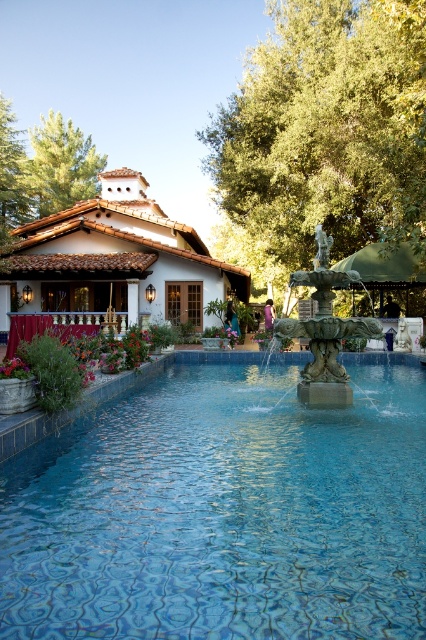
Question: Is blue tile swimming pool at center thinner than green stone fountain at center?

Choices:
 (A) yes
 (B) no

Answer: (B)

Question: Does blue tile swimming pool at center appear over green stone fountain at center?

Choices:
 (A) no
 (B) yes

Answer: (A)

Question: Which of the following is the farthest from the observer?

Choices:
 (A) blue tile swimming pool at center
 (B) green stone fountain at center

Answer: (B)

Question: Does blue tile swimming pool at center have a greater width compared to green stone fountain at center?

Choices:
 (A) yes
 (B) no

Answer: (A)

Question: Which of the following is the closest to the observer?

Choices:
 (A) (60, 604)
 (B) (305, 368)

Answer: (A)

Question: Among these points, which one is farthest from the camera?

Choices:
 (A) (305, 381)
 (B) (175, 560)

Answer: (A)